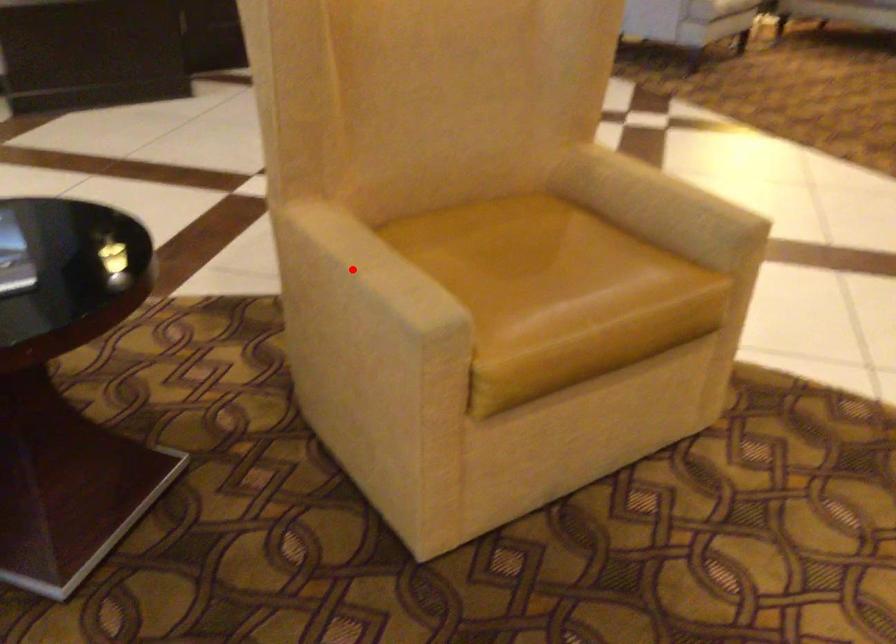
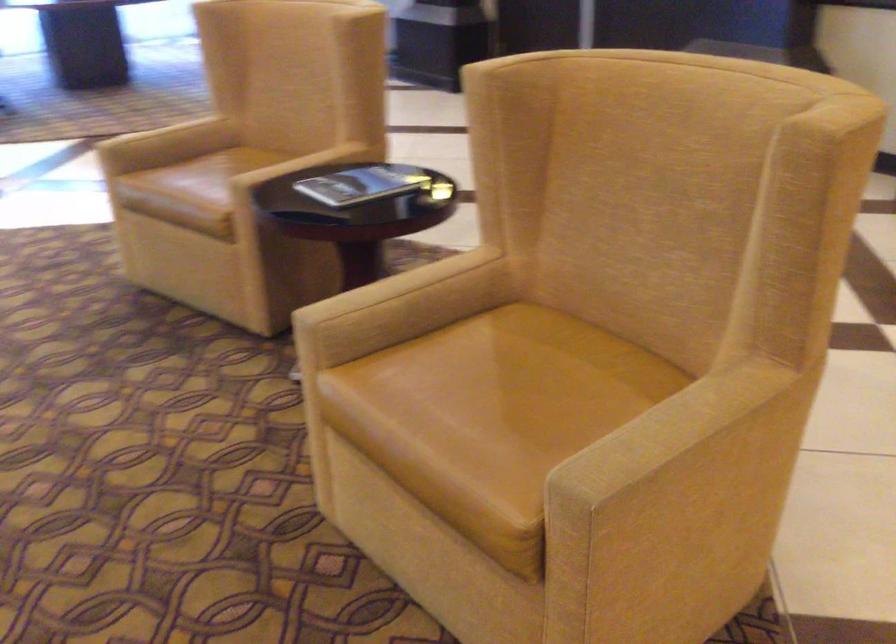
Question: I am providing you with two images of the same scene from different viewpoints. A red point is marked on the first image. Can you still see the location of the red point in image 2?

Choices:
 (A) Yes
 (B) No

Answer: (A)